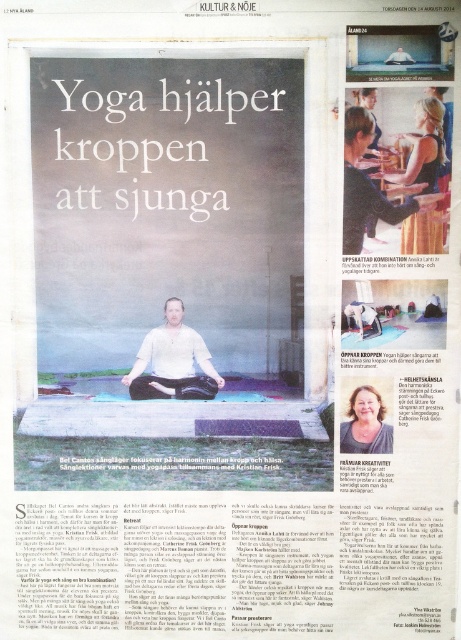
Question: Which point is farther to the camera?

Choices:
 (A) white matte shirt at center
 (B) matte brown hair at lower right

Answer: (A)

Question: Is white matte shirt at center above matte brown hair at lower right?

Choices:
 (A) yes
 (B) no

Answer: (A)

Question: Does matte brown hair at lower right have a greater width compared to matte white shirt at center?

Choices:
 (A) yes
 (B) no

Answer: (A)

Question: Based on their relative distances, which object is nearer to the matte brown hair at lower right?

Choices:
 (A) matte white shirt at center
 (B) white matte shirt at center

Answer: (A)

Question: Which of the following is the closest to the observer?

Choices:
 (A) matte brown hair at lower right
 (B) white matte shirt at center

Answer: (A)

Question: Can you confirm if white matte shirt at center is positioned to the right of matte white shirt at center?

Choices:
 (A) no
 (B) yes

Answer: (A)